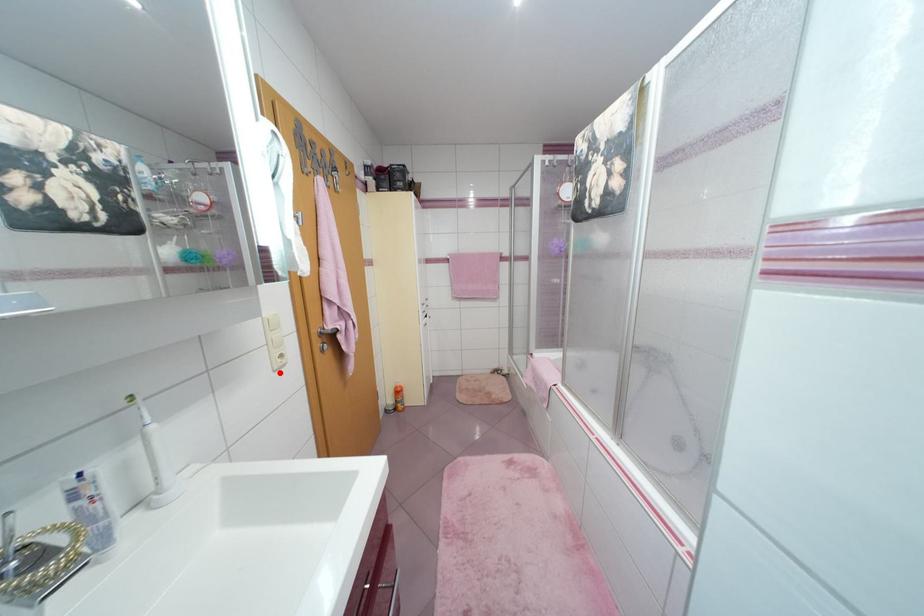
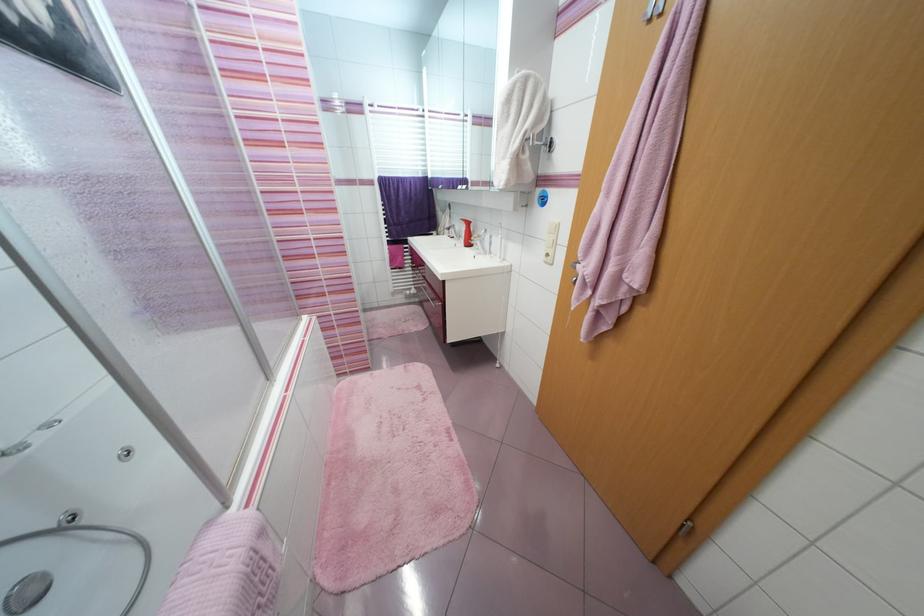
Question: A red point is marked in image1. In image2, is the corresponding 3D point closer to the camera or farther? Reply with the corresponding letter.

Choices:
 (A) The corresponding 3D point is closer.
 (B) The corresponding 3D point is farther.

Answer: (A)